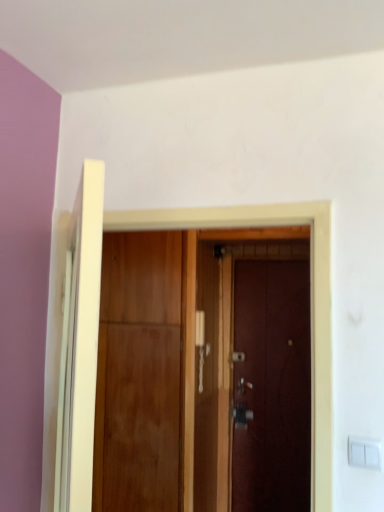
Question: Considering the positions of wooden door at center, the 2th door when ordered from front to back, and wooden door at center, placed as the 1th door when sorted from front to back, in the image, is wooden door at center, the 2th door when ordered from front to back, wider or thinner than wooden door at center, placed as the 1th door when sorted from front to back,?

Choices:
 (A) thin
 (B) wide

Answer: (B)

Question: Which is correct: wooden door at center, the 2th door when ordered from front to back, is inside wooden door at center, placed as the 1th door when sorted from front to back, or outside of it?

Choices:
 (A) outside
 (B) inside

Answer: (A)

Question: Based on their relative distances, which object is nearer to the dark wood door at center, which is the 1th door from back to front?

Choices:
 (A) wooden door at center, the 2th door positioned from the back
 (B) white plastic light switch at lower right
 (C) wooden door at center, placed as the 1th door when sorted from front to back

Answer: (C)

Question: Which object is the farthest from the white plastic light switch at lower right?

Choices:
 (A) wooden door at center, the 2th door when ordered from front to back
 (B) dark wood door at center, placed as the third door when sorted from front to back
 (C) wooden door at center, placed as the 1th door when sorted from front to back

Answer: (B)